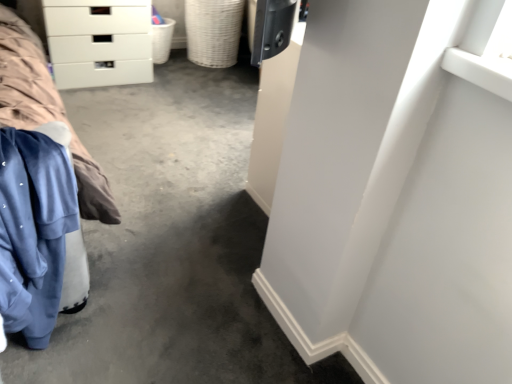
The image size is (512, 384). In order to click on vacant space behind blue fleece at left in this screenshot , I will do `click(115, 266)`.